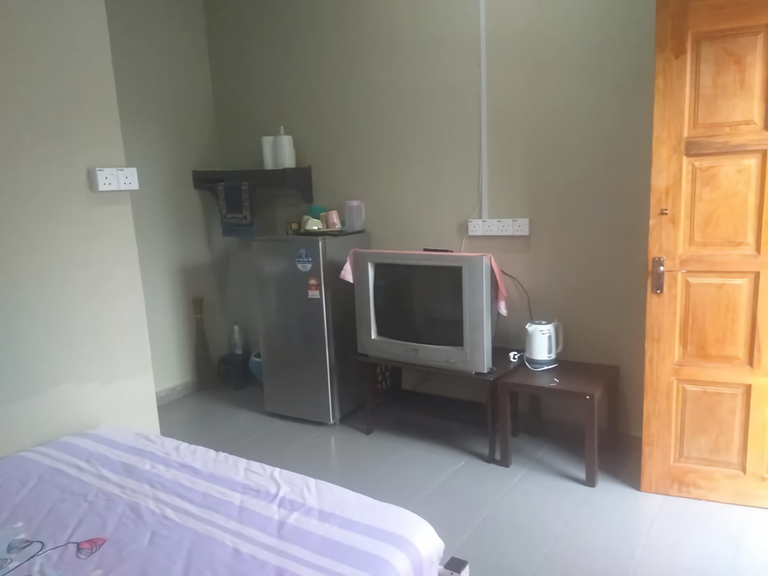
At what (x,y) coordinates should I click in order to perform the action: click on tiled floor. Please return your answer as a coordinate pair (x, y). This screenshot has width=768, height=576. Looking at the image, I should click on (227, 424), (432, 468), (656, 530).